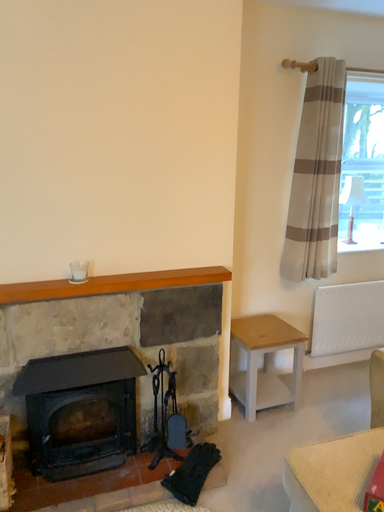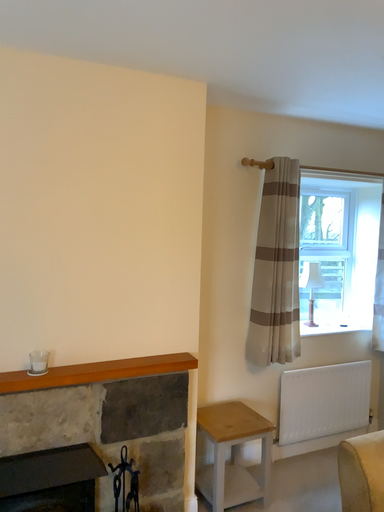
Question: Which way did the camera rotate in the video?

Choices:
 (A) rotated downward
 (B) rotated upward

Answer: (B)